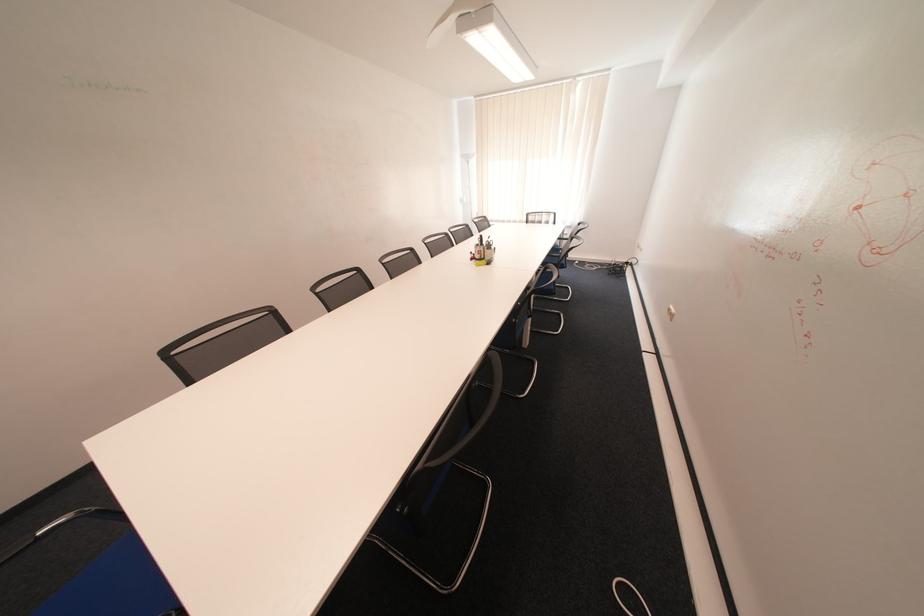
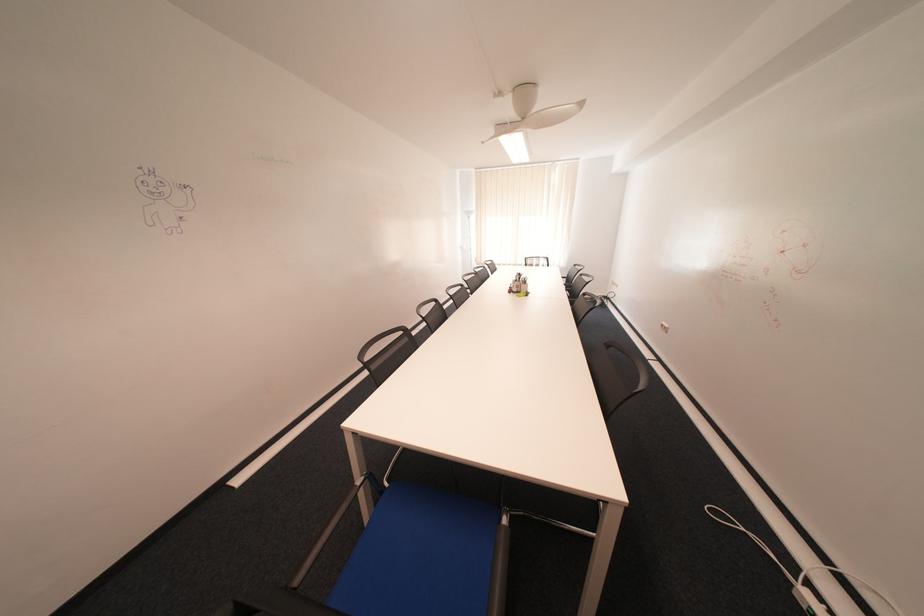
The images are taken continuously from a first-person perspective. In which direction are you moving?

The cameraman moved toward left, backward.